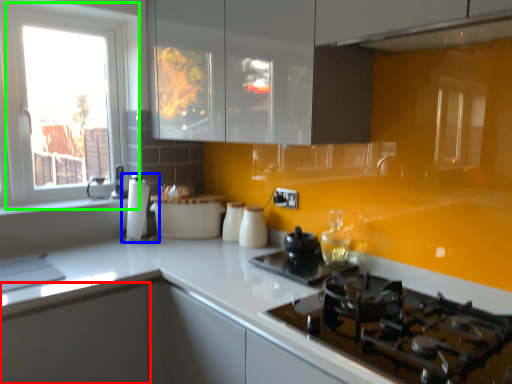
Question: Estimate the real-world distances between objects in this image. Which object is closer to cabinetry (highlighted by a red box), coffee machine (highlighted by a blue box) or window (highlighted by a green box)?

Choices:
 (A) coffee machine
 (B) window

Answer: (A)